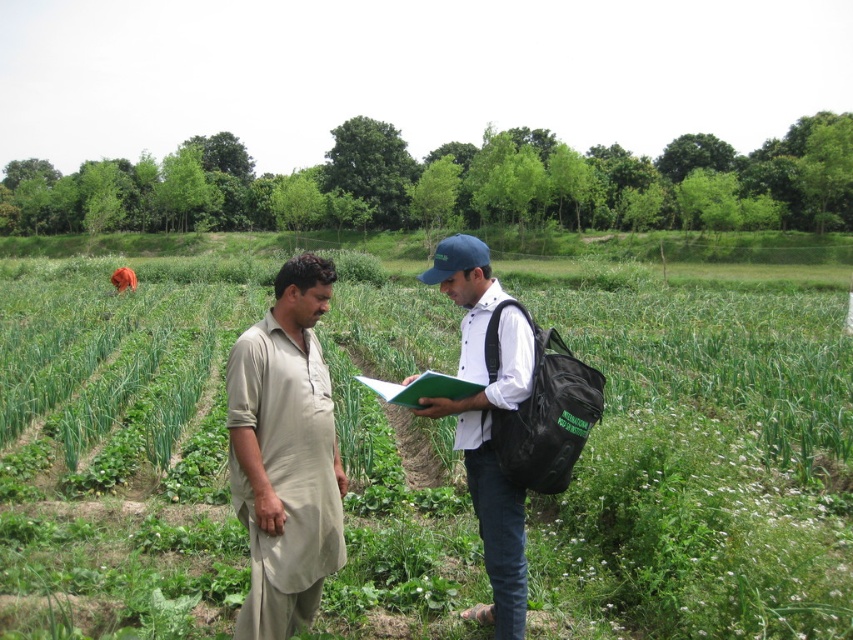
Question: Does green grass at center appear on the right side of beige cotton kurta at center?

Choices:
 (A) no
 (B) yes

Answer: (B)

Question: Is green grass at center wider than white matte shirt at center?

Choices:
 (A) no
 (B) yes

Answer: (B)

Question: Based on their relative distances, which object is nearer to the green grass at center?

Choices:
 (A) white matte shirt at center
 (B) beige cotton kurta at center

Answer: (A)

Question: Can you confirm if beige cotton kurta at center is wider than white matte shirt at center?

Choices:
 (A) no
 (B) yes

Answer: (A)

Question: Which point appears farthest from the camera in this image?

Choices:
 (A) (473, 349)
 (B) (836, 445)

Answer: (B)

Question: Among these points, which one is nearest to the camera?

Choices:
 (A) (521, 632)
 (B) (160, 376)

Answer: (A)